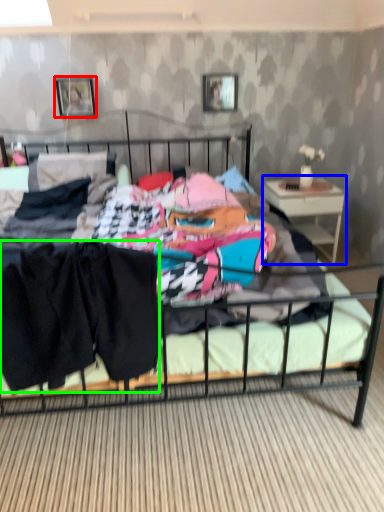
Question: Estimate the real-world distances between objects in this image. Which object is closer to picture frame (highlighted by a red box), nightstand (highlighted by a blue box) or clothing (highlighted by a green box)?

Choices:
 (A) nightstand
 (B) clothing

Answer: (A)